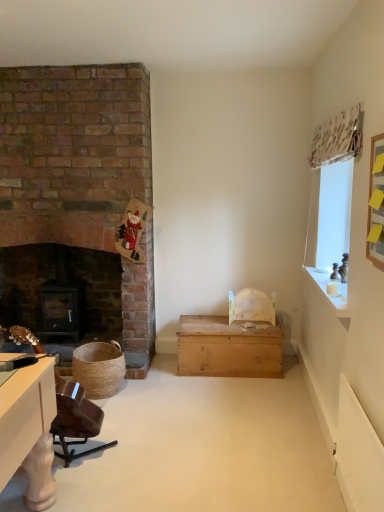
Question: Considering the positions of point tap(100, 418) and point tap(246, 321), is point tap(100, 418) closer or farther from the camera than point tap(246, 321)?

Choices:
 (A) closer
 (B) farther

Answer: (A)

Question: Based on their positions, is brown wood swivel chair at lower left located to the left or right of wooden chest at center?

Choices:
 (A) left
 (B) right

Answer: (A)

Question: Estimate the real-world distances between objects in this image. Which object is farther from the wooden chest at center?

Choices:
 (A) dark wood fireplace at left
 (B) brown wood swivel chair at lower left
 (C) white wood candle at upper right

Answer: (B)

Question: Estimate the real-world distances between objects in this image. Which object is closer to the wooden chest at center?

Choices:
 (A) white wood candle at upper right
 (B) dark wood fireplace at left
 (C) brown wood swivel chair at lower left

Answer: (A)